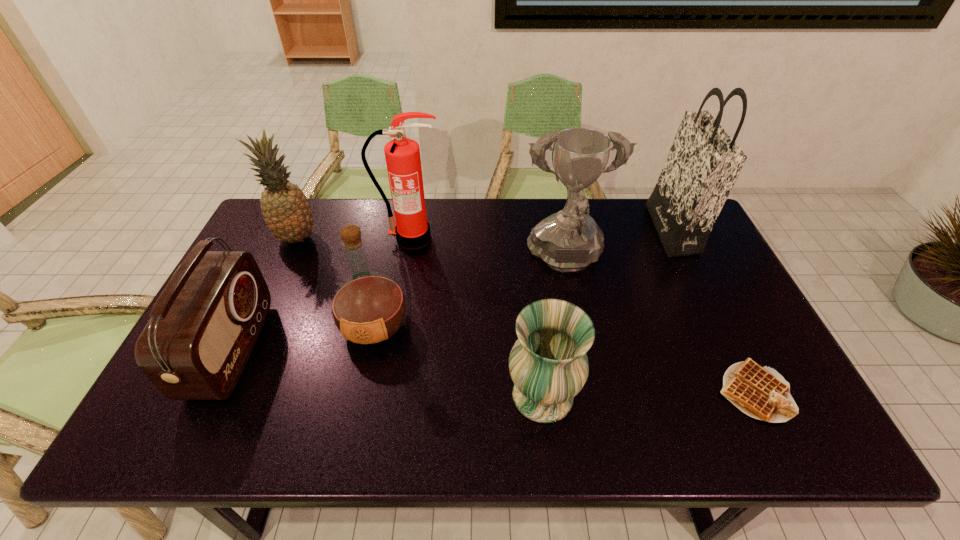
You are a GUI agent. You are given a task and a screenshot of the screen. Output one action in this format:
    pyautogui.click(x=<x>, y=<y>)
    Task: Click on the award that is at the far edge
    
    Given the screenshot: What is the action you would take?
    pyautogui.click(x=570, y=240)

Identify the location of pineapple positioned at the far edge. The image size is (960, 540). (287, 213).

Identify the location of radio receiver that is at the near edge. This screenshot has width=960, height=540. (203, 327).

Where is `vase at the near edge`? The height and width of the screenshot is (540, 960). vase at the near edge is located at coordinates (548, 364).

This screenshot has height=540, width=960. In order to click on waffle at the near edge in this screenshot , I will do `click(760, 392)`.

Locate an element on the screen. pineapple located in the left edge section of the desktop is located at coordinates (287, 213).

Where is `radio receiver located in the left edge section of the desktop`? This screenshot has width=960, height=540. radio receiver located in the left edge section of the desktop is located at coordinates (203, 327).

Where is `shopping bag that is at the right edge`? shopping bag that is at the right edge is located at coordinates (704, 162).

Identify the location of waffle that is at the right edge. (760, 392).

Locate an element on the screen. The width and height of the screenshot is (960, 540). object present at the far left corner is located at coordinates (287, 213).